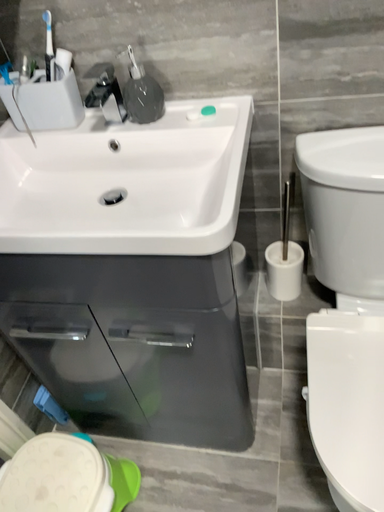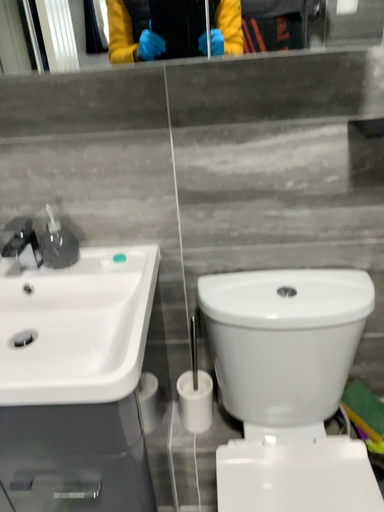
Question: Which way did the camera rotate in the video?

Choices:
 (A) rotated upward
 (B) rotated downward

Answer: (A)